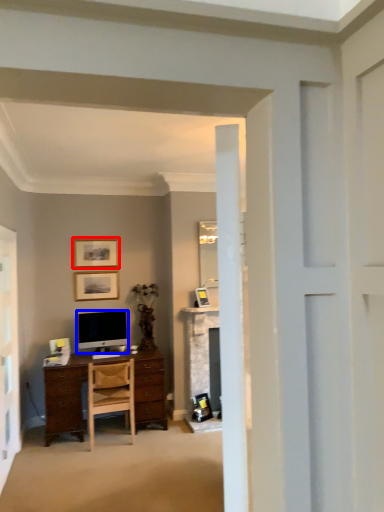
Question: Which object is closer to the camera taking this photo, picture frame (highlighted by a red box) or television (highlighted by a blue box)?

Choices:
 (A) picture frame
 (B) television

Answer: (B)